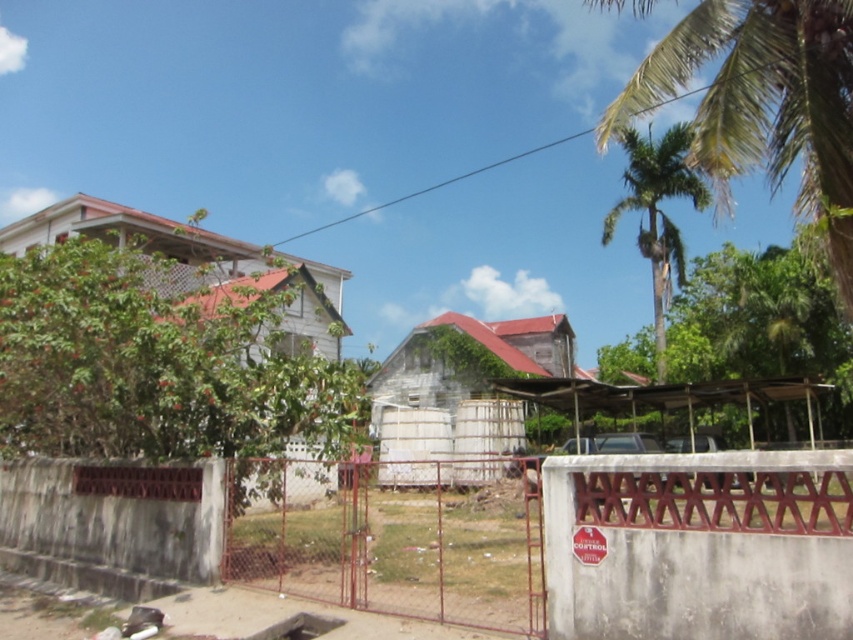
Question: Is rusty metal gate at center further to the viewer compared to green leafy palm tree at upper right?

Choices:
 (A) yes
 (B) no

Answer: (B)

Question: Which point is closer to the camera taking this photo?

Choices:
 (A) (625, 189)
 (B) (355, 573)

Answer: (B)

Question: Does rusty metal gate at center have a lesser width compared to green leafy palm tree at upper right?

Choices:
 (A) no
 (B) yes

Answer: (B)

Question: Is rusty metal gate at center below green leafy palm tree at upper right?

Choices:
 (A) yes
 (B) no

Answer: (A)

Question: Which point is closer to the camera?

Choices:
 (A) green leafy palm tree at upper right
 (B) rusty metal gate at center

Answer: (B)